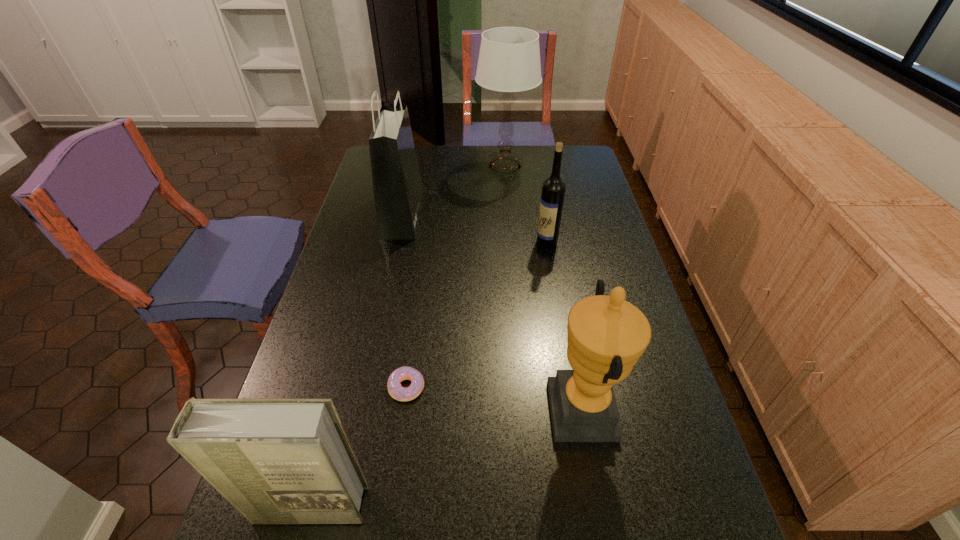
This screenshot has width=960, height=540. Find the location of `free location located at the front of the award with handles`. free location located at the front of the award with handles is located at coordinates (417, 409).

Find the location of a particular element. free space located 0.130m at the front of the award with handles is located at coordinates (494, 409).

Where is `free spot located 0.090m at the front of the award with handles`? The width and height of the screenshot is (960, 540). free spot located 0.090m at the front of the award with handles is located at coordinates (512, 409).

Find the location of a particular element. This screenshot has width=960, height=540. vacant space located 0.250m on the label of the wine bottle is located at coordinates (461, 242).

Find the location of `free region located 0.250m on the label of the wine bottle`. free region located 0.250m on the label of the wine bottle is located at coordinates (461, 242).

Locate an element on the screen. The image size is (960, 540). vacant region located 0.160m on the label of the wine bottle is located at coordinates (488, 242).

Where is `vacant space positioned on the right of the doughnut`? The image size is (960, 540). vacant space positioned on the right of the doughnut is located at coordinates (478, 387).

Where is `object present at the far edge`? object present at the far edge is located at coordinates (509, 59).

Image resolution: width=960 pixels, height=540 pixels. Find the location of `shopping bag present at the left edge`. shopping bag present at the left edge is located at coordinates (398, 191).

This screenshot has height=540, width=960. What are the coordinates of `phonebook situated at the left edge` in the screenshot? It's located at (288, 460).